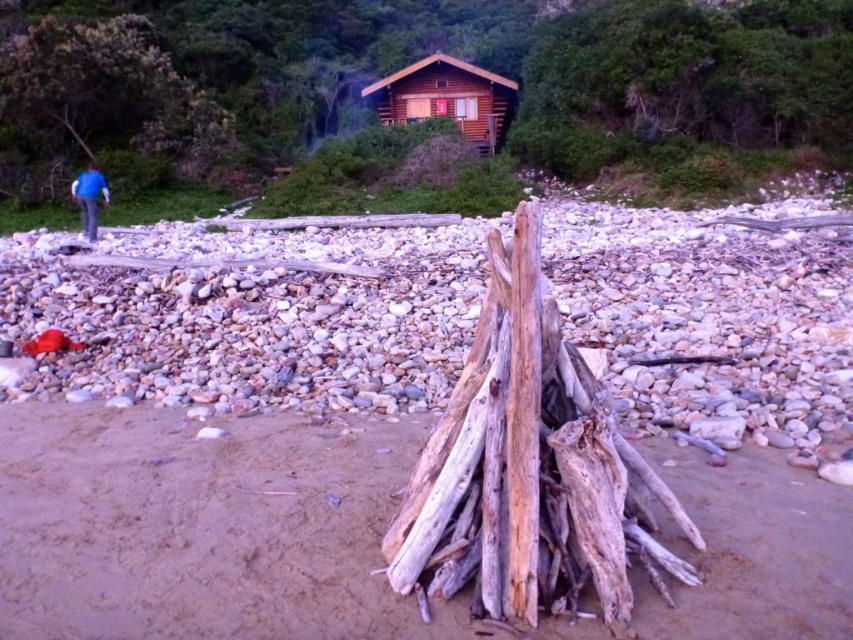
Question: Is light brown wood at center thinner than blue fabric jacket at left?

Choices:
 (A) yes
 (B) no

Answer: (A)

Question: Which is farther from the light brown wood at center?

Choices:
 (A) brown wooden log cabin at upper center
 (B) smooth tan sand at center

Answer: (A)

Question: Which of the following is the farthest from the observer?

Choices:
 (A) (82, 230)
 (B) (416, 474)
 (C) (469, 88)

Answer: (C)

Question: Which of the following is the closest to the observer?

Choices:
 (A) smooth tan sand at center
 (B) blue fabric jacket at left
 (C) light brown wood at center

Answer: (A)

Question: Does light brown wood at center come behind brown wooden log cabin at upper center?

Choices:
 (A) yes
 (B) no

Answer: (B)

Question: Does smooth tan sand at center have a smaller size compared to blue fabric jacket at left?

Choices:
 (A) no
 (B) yes

Answer: (B)